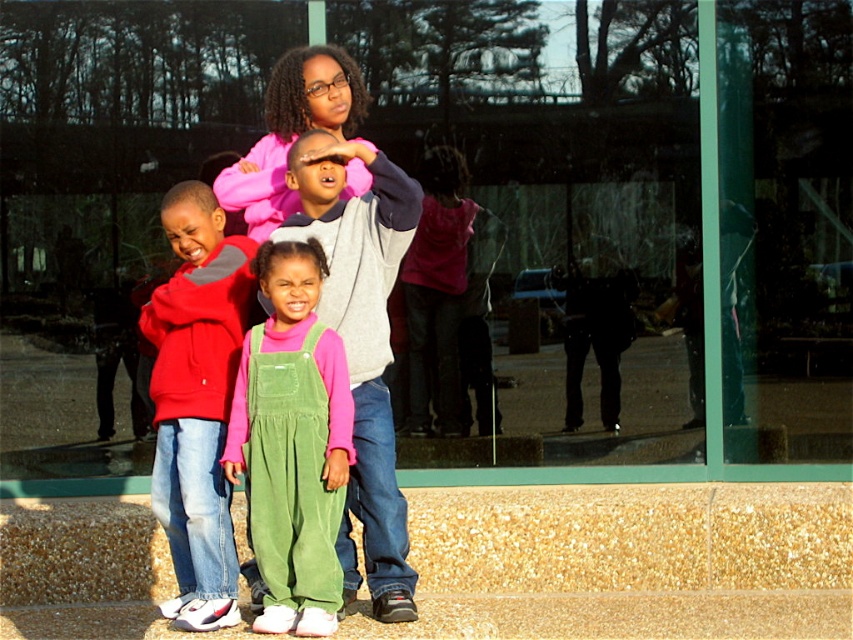
Image resolution: width=853 pixels, height=640 pixels. What do you see at coordinates (292, 442) in the screenshot? I see `green corduroy overalls at center` at bounding box center [292, 442].

Between point (305, 528) and point (355, 276), which one is positioned behind?

The point (355, 276) is behind.

You are a GUI agent. You are given a task and a screenshot of the screen. Output one action in this format:
    pyautogui.click(x=<x>, y=<y>)
    Task: Click on the green corduroy overalls at center
    This screenshot has width=853, height=640.
    Given the screenshot: What is the action you would take?
    pyautogui.click(x=292, y=442)

Is green corduroy overalls at center in front of red hoodie at left?

Yes.

Between green corduroy overalls at center and red hoodie at left, which one is positioned lower?

green corduroy overalls at center is lower down.

Does point (250, 451) come in front of point (199, 358)?

That is True.

What are the coordinates of `green corduroy overalls at center` in the screenshot? It's located at (292, 442).

Can you confirm if red hoodie at left is smaller than pink fleece sweatshirt at center?

Correct, red hoodie at left occupies less space than pink fleece sweatshirt at center.

Is red hoodie at left shorter than pink fleece sweatshirt at center?

Correct, red hoodie at left is not as tall as pink fleece sweatshirt at center.

Is point (190, 236) positioned in front of point (392, 486)?

Yes.

Locate an element on the screen. The width and height of the screenshot is (853, 640). red hoodie at left is located at coordinates (196, 401).